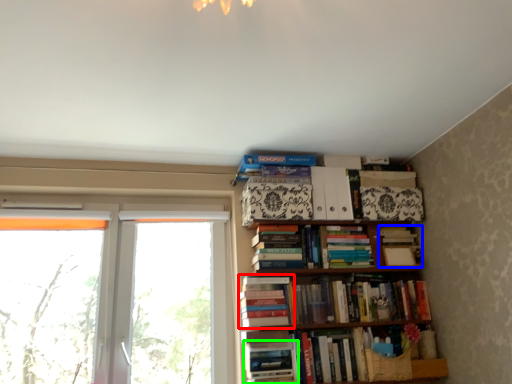
Question: Which object is the farthest from book (highlighted by a red box)? Choose among these: book (highlighted by a blue box) or book (highlighted by a green box).

Choices:
 (A) book
 (B) book

Answer: (A)